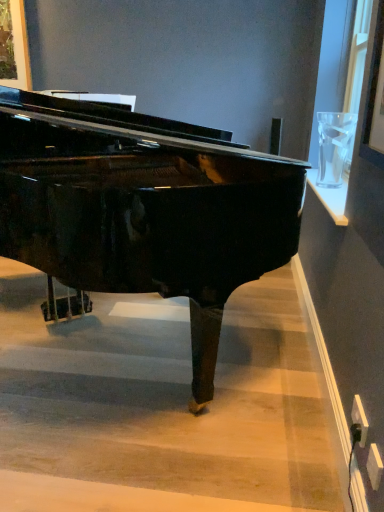
Question: Considering the relative positions of glossy black piano at center and wooden stairwell at center in the image provided, is glossy black piano at center to the left or to the right of wooden stairwell at center?

Choices:
 (A) right
 (B) left

Answer: (B)

Question: Looking at the image, does glossy black piano at center seem bigger or smaller compared to wooden stairwell at center?

Choices:
 (A) small
 (B) big

Answer: (B)

Question: From the image's perspective, is glossy black piano at center positioned above or below wooden stairwell at center?

Choices:
 (A) below
 (B) above

Answer: (B)

Question: Considering the positions of wooden stairwell at center and glossy black piano at center in the image, is wooden stairwell at center taller or shorter than glossy black piano at center?

Choices:
 (A) short
 (B) tall

Answer: (A)

Question: Would you say wooden stairwell at center is to the left or to the right of glossy black piano at center in the picture?

Choices:
 (A) right
 (B) left

Answer: (A)

Question: Considering the positions of wooden stairwell at center and glossy black piano at center in the image, is wooden stairwell at center bigger or smaller than glossy black piano at center?

Choices:
 (A) small
 (B) big

Answer: (A)

Question: From the image's perspective, relative to glossy black piano at center, is wooden stairwell at center above or below?

Choices:
 (A) below
 (B) above

Answer: (A)